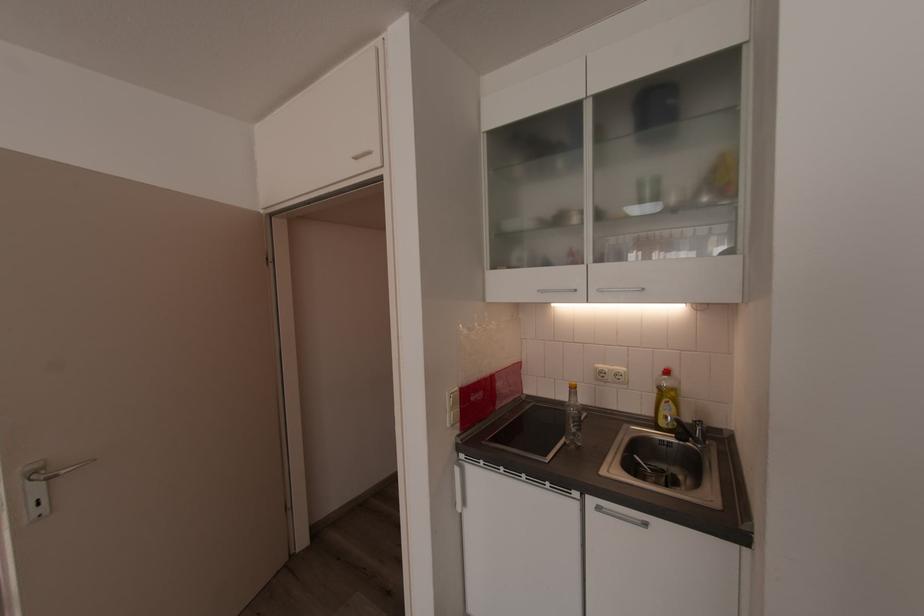
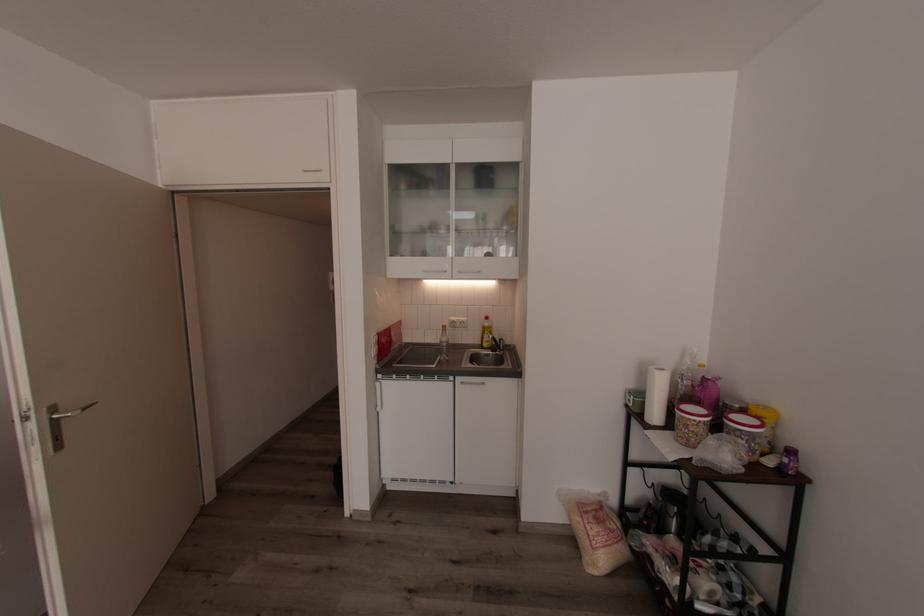
Question: I am providing you with two images of the same scene from different viewpoints. Please identify which objects are invisible in image2.

Choices:
 (A) glass bottle
 (B) yellow plastic bottle
 (C) silver cabinet handle
 (D) none of these

Answer: (D)